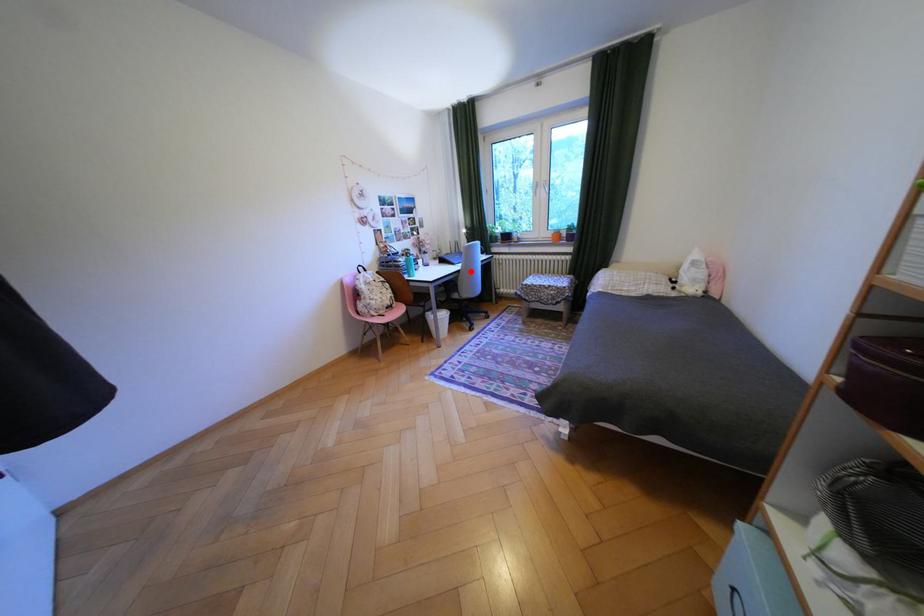
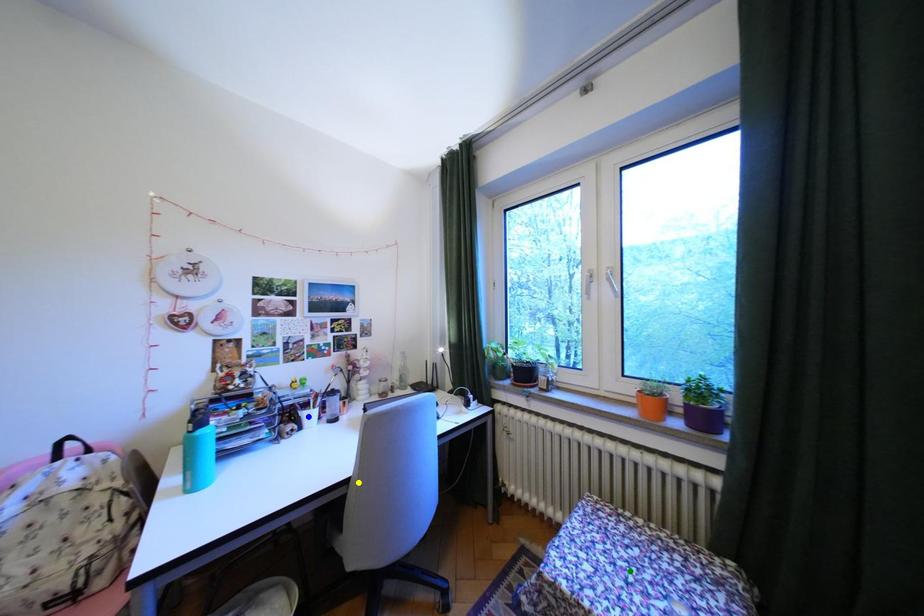
Question: I am providing you with two images of the same scene from different viewpoints. A red point is marked on the first image. You are given multiple points on the second image. In image 2, which mark is for the same physical point as the one in image 1?

Choices:
 (A) yellow point
 (B) blue point
 (C) green point

Answer: (A)